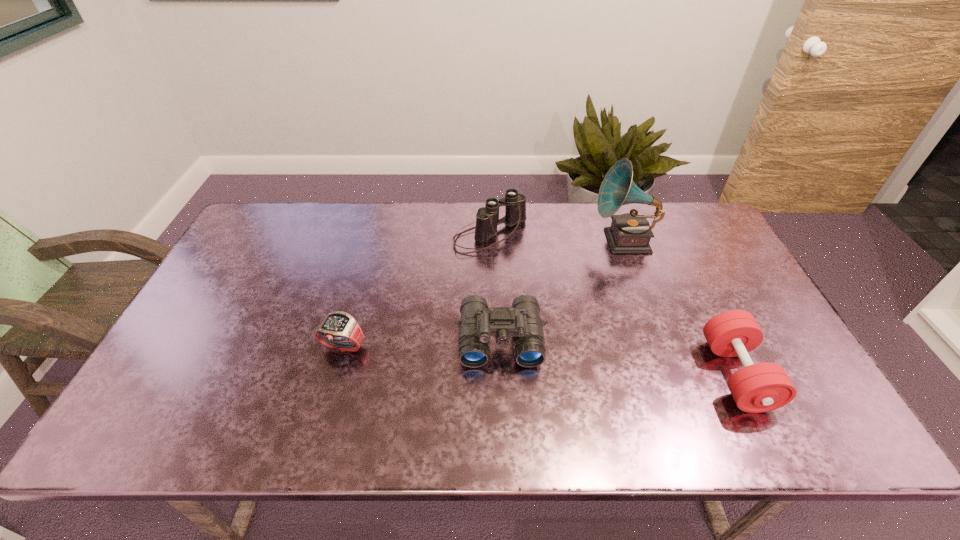
You are a GUI agent. You are given a task and a screenshot of the screen. Output one action in this format:
    pyautogui.click(x=<x>, y=<y>)
    Task: Click on the free space between the nearer binoculars and the watch
    This screenshot has width=960, height=540.
    Given the screenshot: What is the action you would take?
    pyautogui.click(x=421, y=343)

Locate an element on the screen. This screenshot has width=960, height=540. vacant point located between the farther binoculars and the dumbbell is located at coordinates (613, 305).

This screenshot has width=960, height=540. In order to click on blank region between the watch and the tallest object in this screenshot , I will do `click(483, 294)`.

At what (x,y) coordinates should I click in order to perform the action: click on object identified as the second closest to the dumbbell. Please return your answer as a coordinate pair (x, y). The height and width of the screenshot is (540, 960). Looking at the image, I should click on (478, 322).

The height and width of the screenshot is (540, 960). What are the coordinates of `the fourth closest object to the leftmost object` in the screenshot? It's located at (762, 387).

Where is `free space that satisfies the following two spatial constraints: 1. from the horn of the tallest object; 2. on the back side of the dumbbell`? free space that satisfies the following two spatial constraints: 1. from the horn of the tallest object; 2. on the back side of the dumbbell is located at coordinates (673, 374).

The image size is (960, 540). In order to click on vacant space that satisfies the following two spatial constraints: 1. from the horn of the tallest object; 2. on the back side of the dumbbell in this screenshot , I will do `click(673, 374)`.

At what (x,y) coordinates should I click in order to perform the action: click on free space that satisfies the following two spatial constraints: 1. on the back side of the dumbbell; 2. from the horn of the phonograph_record. Please return your answer as a coordinate pair (x, y). The image size is (960, 540). Looking at the image, I should click on (671, 241).

This screenshot has width=960, height=540. I want to click on free spot that satisfies the following two spatial constraints: 1. from the horn of the tallest object; 2. on the right side of the dumbbell, so point(673,374).